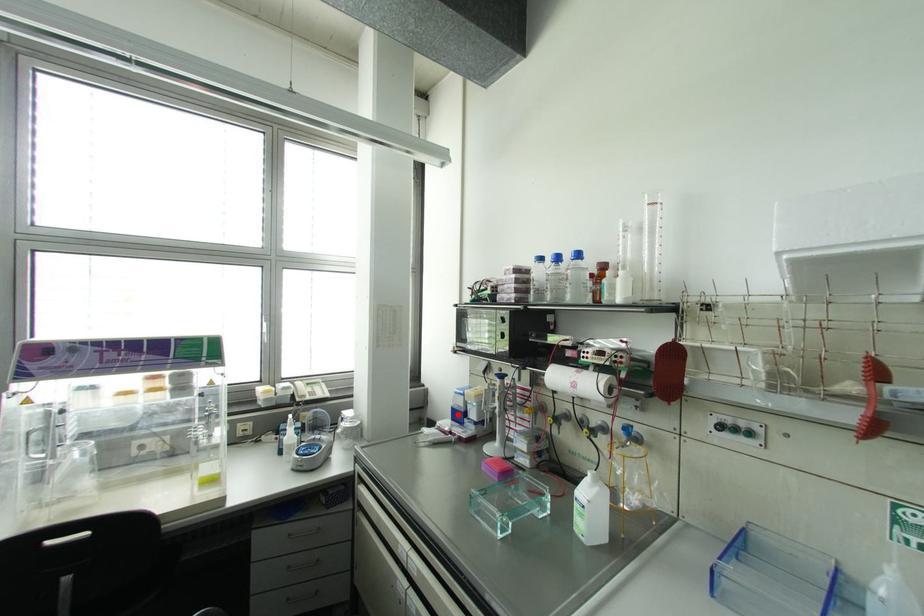
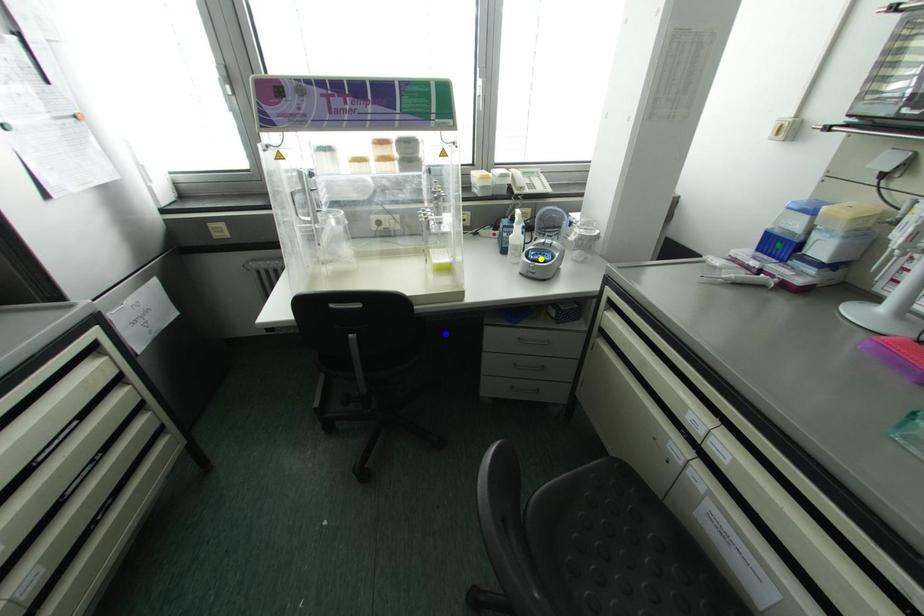
Question: I am providing you with two images of the same scene from different viewpoints. A red point is marked on the first image. You are given multiple points on the second image. Which mark in image 2 goes with the point in image 1?

Choices:
 (A) green point
 (B) blue point
 (C) yellow point

Answer: (A)